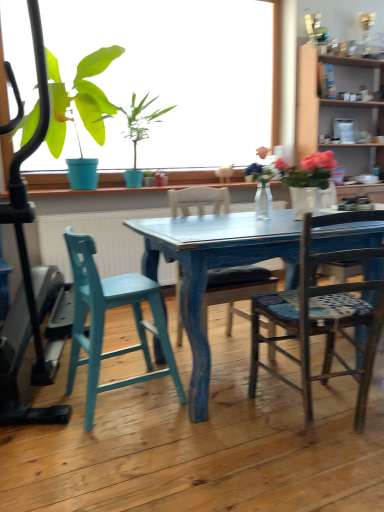
Question: From the image's perspective, is green matte plant at upper left above or below wooden cabinet at upper right?

Choices:
 (A) above
 (B) below

Answer: (A)

Question: From a real-world perspective, is green matte plant at upper left above or below wooden cabinet at upper right?

Choices:
 (A) above
 (B) below

Answer: (A)

Question: Based on their relative distances, which object is nearer to the teal wood stool at left, which appears as the 3th chair when viewed from the right?

Choices:
 (A) wooden chair at center, the second chair in the right-to-left sequence
 (B) matte white mug at upper center
 (C) wooden cabinet at upper right
 (D) green matte plant at upper left
 (E) wooden chair with patterned seat cushion at center, the 1th chair when ordered from right to left

Answer: (A)

Question: Which of these objects is positioned farthest from the wooden chair with patterned seat cushion at center, the 1th chair when ordered from right to left?

Choices:
 (A) teal wood stool at left, which ranks as the 1th chair in left-to-right order
 (B) wooden cabinet at upper right
 (C) green matte plant at upper left
 (D) wooden chair at center, the second chair in the right-to-left sequence
 (E) matte white mug at upper center

Answer: (E)